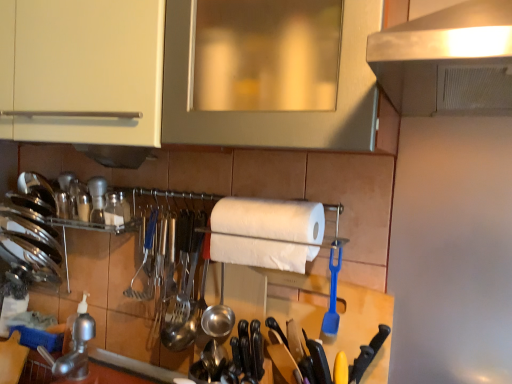
Where is `blank space situated above white matte paper towel at center (from a real-world perspective)`? This screenshot has width=512, height=384. blank space situated above white matte paper towel at center (from a real-world perspective) is located at coordinates (274, 199).